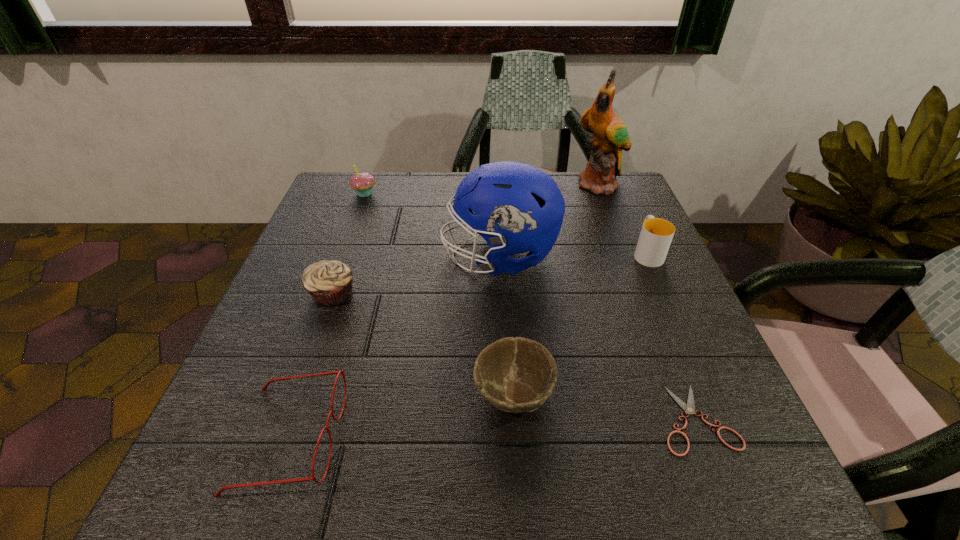
At what (x,y) coordinates should I click in order to perform the action: click on parrot located at the far edge. Please return your answer as a coordinate pair (x, y). The height and width of the screenshot is (540, 960). Looking at the image, I should click on (610, 136).

I want to click on cupcake that is at the far edge, so click(363, 182).

Identify the location of spectacles present at the near edge. This screenshot has width=960, height=540. (264, 388).

Find the location of a particular element. shears that is at the near edge is located at coordinates (689, 408).

The image size is (960, 540). What are the coordinates of `cupcake at the left edge` in the screenshot? It's located at (363, 182).

This screenshot has height=540, width=960. Find the location of `muffin located in the left edge section of the desktop`. muffin located in the left edge section of the desktop is located at coordinates (330, 283).

This screenshot has width=960, height=540. I want to click on spectacles present at the left edge, so click(264, 388).

What are the coordinates of `parrot located at the right edge` in the screenshot? It's located at (x=610, y=136).

Find the location of `cup situated at the right edge`. cup situated at the right edge is located at coordinates (656, 234).

Where is `shears at the right edge`? The image size is (960, 540). shears at the right edge is located at coordinates (689, 408).